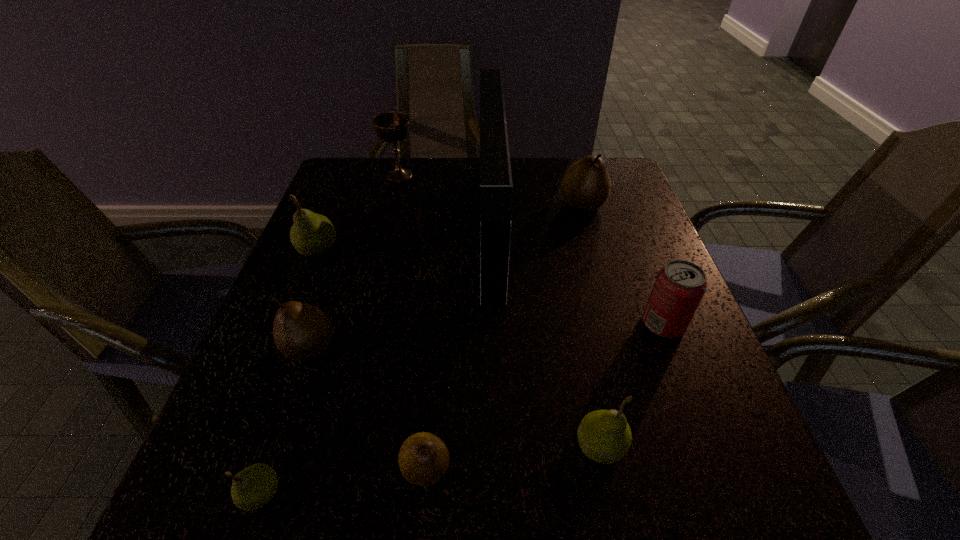
This screenshot has height=540, width=960. I want to click on free space located 0.310m on the back of the farthest green pear, so click(x=350, y=168).

I want to click on vacant area situated on the back of the soda can, so coord(645,277).

The height and width of the screenshot is (540, 960). Identify the location of free space located 0.060m on the front of the second smallest brown pear. (292, 399).

The image size is (960, 540). Find the location of `vacant space located on the right of the second smallest green pear`. vacant space located on the right of the second smallest green pear is located at coordinates (722, 446).

This screenshot has height=540, width=960. What are the coordinates of `vacant space located on the right of the nearest green pear` in the screenshot? It's located at [398, 493].

Locate an element on the screen. free space located 0.130m on the right of the fifth object from left to right is located at coordinates (537, 468).

Where is `videotape at the far edge`? This screenshot has width=960, height=540. videotape at the far edge is located at coordinates (496, 187).

Locate an element on the screen. The image size is (960, 540). chalice present at the far edge is located at coordinates (392, 127).

This screenshot has width=960, height=540. Find the location of `pear at the far edge`. pear at the far edge is located at coordinates (586, 185).

At what (x,y) coordinates should I click in order to perform the action: click on chalice that is positioned at the left edge. Please return your answer as a coordinate pair (x, y). Looking at the image, I should click on (392, 127).